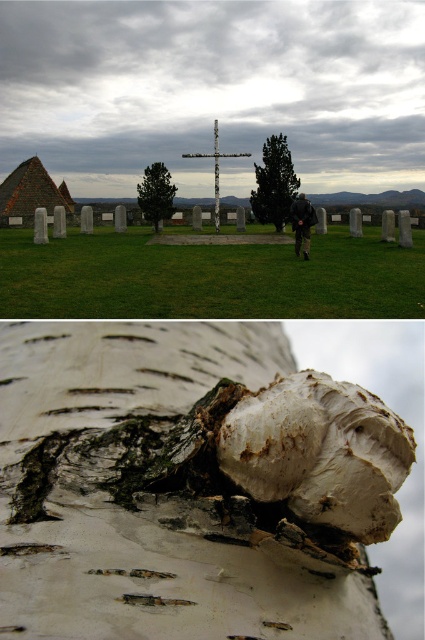
How distant is white bark hut at left from green bark tree at center?

60.78 feet

Does white bark hut at left have a larger size compared to green bark tree at center?

Indeed, white bark hut at left has a larger size compared to green bark tree at center.

Who is more distant from viewer, (22, 204) or (153, 182)?

The point (22, 204) is behind.

Where is `white bark hut at left`? This screenshot has height=640, width=425. white bark hut at left is located at coordinates (31, 193).

What do you see at coordinates (274, 182) in the screenshot?
I see `white textured mushroom at center` at bounding box center [274, 182].

Is white textured mushroom at center closer to the viewer compared to white bark hut at left?

Yes, it is in front of white bark hut at left.

Is point (263, 209) positioned behind point (8, 176)?

No, (263, 209) is closer to viewer.

The height and width of the screenshot is (640, 425). Identify the location of white textured mushroom at center. (274, 182).

Can you confirm if white birch bark at center is bigger than green bark tree at center?

Incorrect, white birch bark at center is not larger than green bark tree at center.

Which is above, white birch bark at center or green bark tree at center?

Positioned higher is green bark tree at center.

Which is behind, point (379, 493) or point (163, 179)?

The point (163, 179) is more distant.

I want to click on white birch bark at center, so click(187, 484).